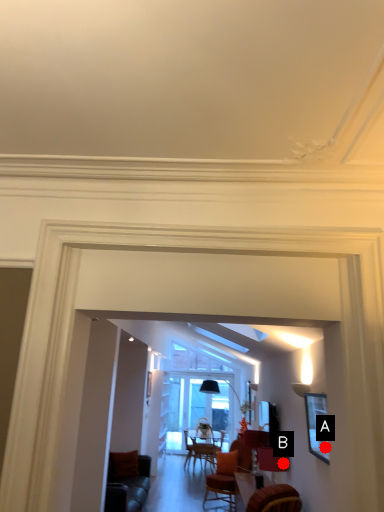
Question: Two points are circled on the image, labeled by A and B beside each circle. Which point is closer to the camera?

Choices:
 (A) A is closer
 (B) B is closer

Answer: (A)